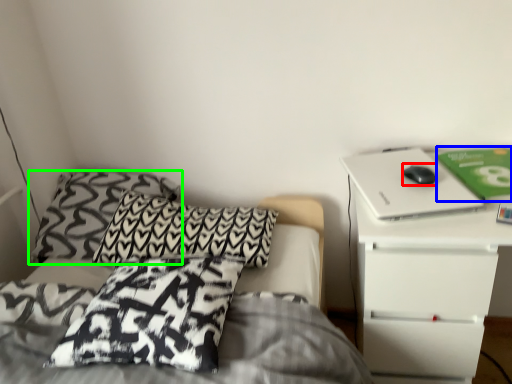
Question: Based on their relative distances, which object is farther from mouse (highlighted by a red box)? Choose from paperback book (highlighted by a blue box) and pillow (highlighted by a green box).

Choices:
 (A) paperback book
 (B) pillow

Answer: (B)